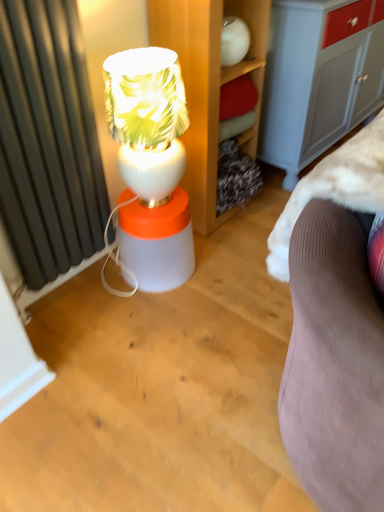
The width and height of the screenshot is (384, 512). Identify the location of matte white lampshade at upper center. (151, 164).

Measure the distance between point (179, 270) and camera.

Point (179, 270) and camera are 5.96 feet apart from each other.

The height and width of the screenshot is (512, 384). What do you see at coordinates (151, 164) in the screenshot?
I see `matte white lampshade at upper center` at bounding box center [151, 164].

This screenshot has width=384, height=512. I want to click on matte white lampshade at upper center, so click(x=151, y=164).